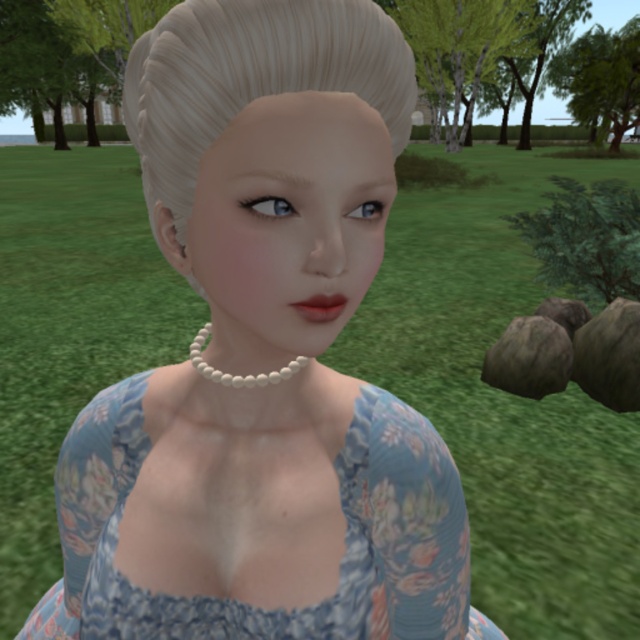
You are an artist trying to sketch the scene. The point at coordinates (344, 536) is important for locating the main subject. Which object in the image is at this point?

The point at coordinates (344, 536) corresponds to the blue floral fabric dress at center.

You are a photographer setting up a tripod at position point 0.7, 0.5. You want to capture the blue floral fabric dress at center in the frame. Is the dress within the camera view if the camera has a 60 degree field of view?

The blue floral fabric dress at center is located at point (344, 536). The photographer is at point (320, 448). The distance between them is sqrt of squared differences in coordinates. Let me calculate that. The x difference is 0.139, y difference is 0.039. Squared differences are 0.0193 and 0.0015. Sum is 0.0208, square root is approx 0.144. Assuming the field of view covers up to 0.15 units, the dress is within the 60 degree field of view.

You are a photographer setting up for a portrait. You need to ensure that the blue floral fabric dress at center and the blonde smooth hair at center are both visible in the frame. Given that the dress is wider than the hair, which object should you adjust your camera angle to focus on first to ensure both are fully captured?

Since the blue floral fabric dress at center is wider than the blonde smooth hair at center, you should first adjust your camera angle to focus on the dress to ensure its full width is captured, as it requires more space in the frame.